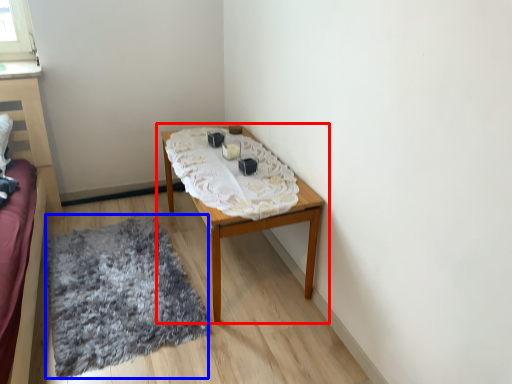
Question: Which object appears farthest to the camera in this image, table (highlighted by a red box) or mat (highlighted by a blue box)?

Choices:
 (A) table
 (B) mat

Answer: (A)